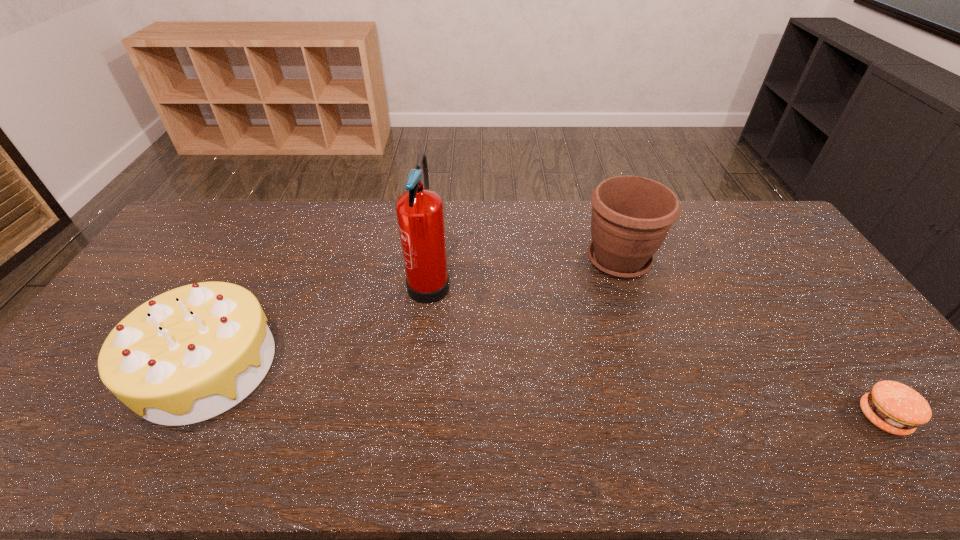
Find the location of a particular element. The image size is (960, 540). vacant region located 0.350m on the back of the leftmost object is located at coordinates (x=274, y=239).

Where is `vacant area situated on the back of the patty`? This screenshot has width=960, height=540. vacant area situated on the back of the patty is located at coordinates (790, 286).

Identify the location of object located in the far edge section of the desktop. (631, 216).

Where is `object that is at the near edge`? The height and width of the screenshot is (540, 960). object that is at the near edge is located at coordinates (896, 408).

Find the location of a particular element. The image size is (960, 540). object at the right edge is located at coordinates (896, 408).

Identify the location of object present at the near right corner. Image resolution: width=960 pixels, height=540 pixels. (896, 408).

Image resolution: width=960 pixels, height=540 pixels. What are the coordinates of `vacant area at the far edge of the desktop` in the screenshot? It's located at (685, 230).

In the image, there is a desktop. Identify the location of vacant space at the near edge. (541, 444).

In the image, there is a desktop. Identify the location of vacant area at the left edge. The width and height of the screenshot is (960, 540). (97, 384).

I want to click on vacant space at the right edge of the desktop, so click(x=809, y=312).